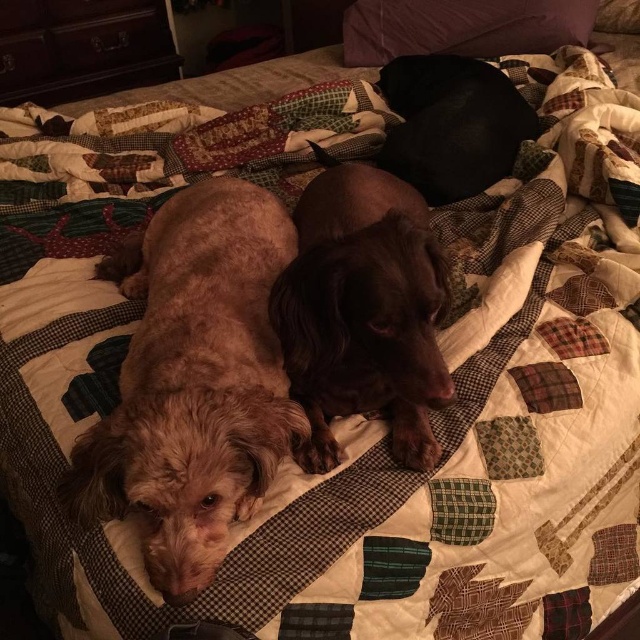
Which of these two, dark wood dresser at upper left or purple fabric pillow at upper center, stands shorter?

purple fabric pillow at upper center

Does point (61, 33) come closer to viewer compared to point (582, 19)?

No, (61, 33) is behind (582, 19).

Is point (164, 26) positioned after point (352, 29)?

Yes, it is.

You are a GUI agent. You are given a task and a screenshot of the screen. Output one action in this format:
    pyautogui.click(x=<x>, y=<y>)
    Task: Click on the dark wood dresser at upper left
    This screenshot has height=640, width=640.
    Given the screenshot: What is the action you would take?
    pyautogui.click(x=88, y=54)

Between shiny brown dog at center and black smooth dog at upper center, which one appears on the right side from the viewer's perspective?

black smooth dog at upper center

Is point (326, 333) less distant than point (406, 56)?

Yes.

Between point (364, 388) and point (416, 118), which one is positioned behind?

Point (416, 118)

In order to click on shiny brown dog at center in this screenshot , I will do `click(364, 312)`.

Can you confirm if shiny brown dog at center is shorter than dark wood dresser at upper left?

Correct, shiny brown dog at center is not as tall as dark wood dresser at upper left.

Does shiny brown dog at center have a smaller size compared to dark wood dresser at upper left?

Indeed, shiny brown dog at center has a smaller size compared to dark wood dresser at upper left.

Locate an element on the screen. The width and height of the screenshot is (640, 640). shiny brown dog at center is located at coordinates (364, 312).

I want to click on shiny brown dog at center, so click(x=364, y=312).